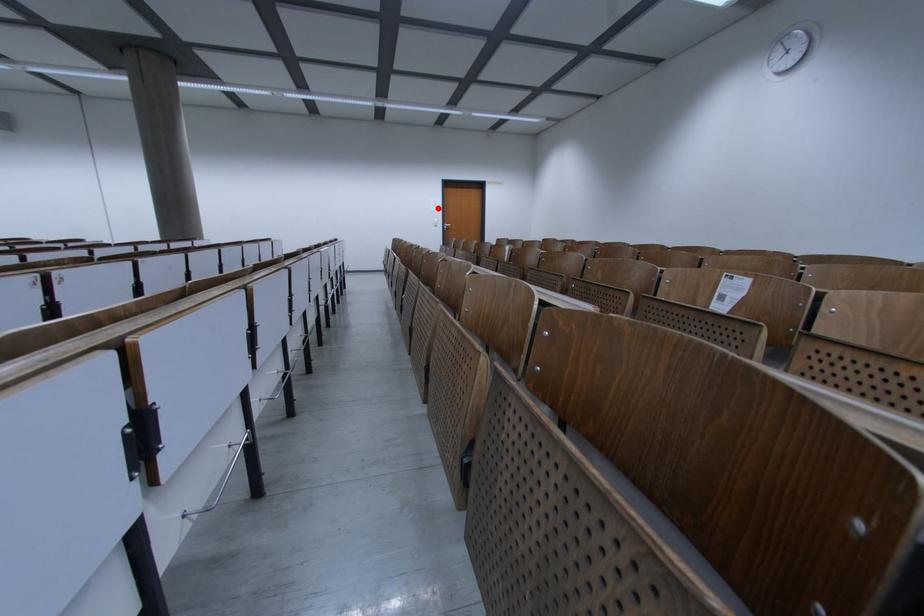
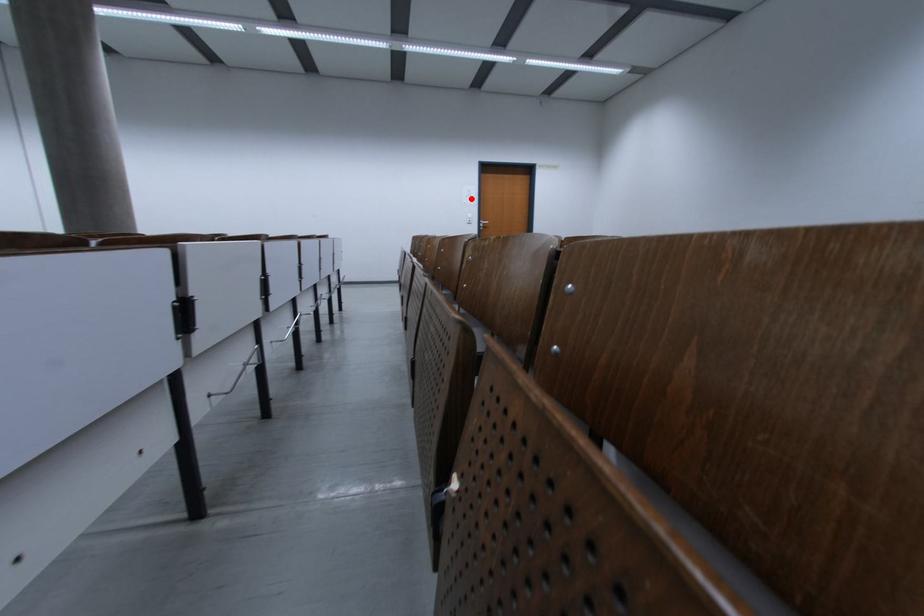
I am providing you with two images of the same scene from different viewpoints. A red point is marked on the first image and another point is marked on the second image. Does the point marked in image1 correspond to the same location as the one in image2?

Yes